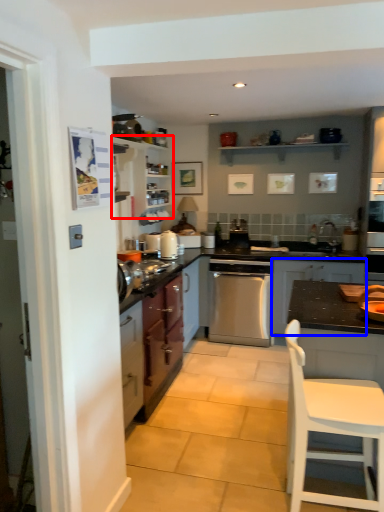
Question: Which object appears farthest to the camera in this image, cabinetry (highlighted by a red box) or cabinetry (highlighted by a blue box)?

Choices:
 (A) cabinetry
 (B) cabinetry

Answer: (A)